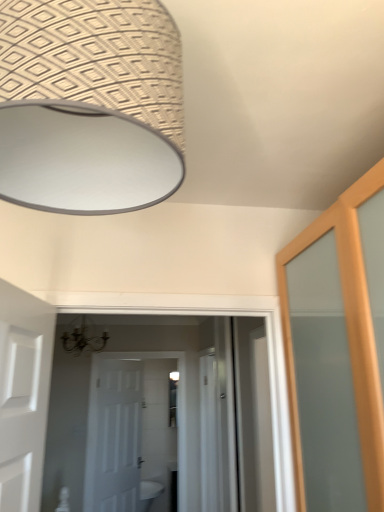
Question: Can white glossy sink at lower center be found inside white glossy screen door at center?

Choices:
 (A) yes
 (B) no

Answer: (B)

Question: Does white glossy screen door at center lie behind white glossy sink at lower center?

Choices:
 (A) no
 (B) yes

Answer: (A)

Question: From the image's perspective, is white glossy screen door at center on white glossy sink at lower center?

Choices:
 (A) yes
 (B) no

Answer: (A)

Question: Is white glossy screen door at center looking in the opposite direction of white glossy sink at lower center?

Choices:
 (A) yes
 (B) no

Answer: (B)

Question: From the image's perspective, does white glossy screen door at center appear lower than white glossy sink at lower center?

Choices:
 (A) yes
 (B) no

Answer: (B)

Question: Is white matte door at center inside or outside of white glossy screen door at center?

Choices:
 (A) inside
 (B) outside

Answer: (B)

Question: In terms of height, does white matte door at center look taller or shorter compared to white glossy screen door at center?

Choices:
 (A) short
 (B) tall

Answer: (B)

Question: Is point (125, 474) closer or farther from the camera than point (205, 463)?

Choices:
 (A) farther
 (B) closer

Answer: (A)

Question: Visually, is white matte door at center positioned to the left or to the right of white glossy screen door at center?

Choices:
 (A) right
 (B) left

Answer: (B)

Question: Considering the positions of white matte door at center and white glossy sink at lower center in the image, is white matte door at center bigger or smaller than white glossy sink at lower center?

Choices:
 (A) big
 (B) small

Answer: (B)

Question: Is white matte door at center inside or outside of white glossy sink at lower center?

Choices:
 (A) outside
 (B) inside

Answer: (A)

Question: Is white matte door at center to the left or to the right of white glossy sink at lower center in the image?

Choices:
 (A) right
 (B) left

Answer: (B)

Question: Considering the positions of point (105, 393) and point (148, 503), is point (105, 393) closer or farther from the camera than point (148, 503)?

Choices:
 (A) farther
 (B) closer

Answer: (B)

Question: From a real-world perspective, is white glossy screen door at center physically located above or below white matte door at center?

Choices:
 (A) above
 (B) below

Answer: (A)

Question: Relative to white matte door at center, is white glossy screen door at center in front or behind?

Choices:
 (A) front
 (B) behind

Answer: (A)